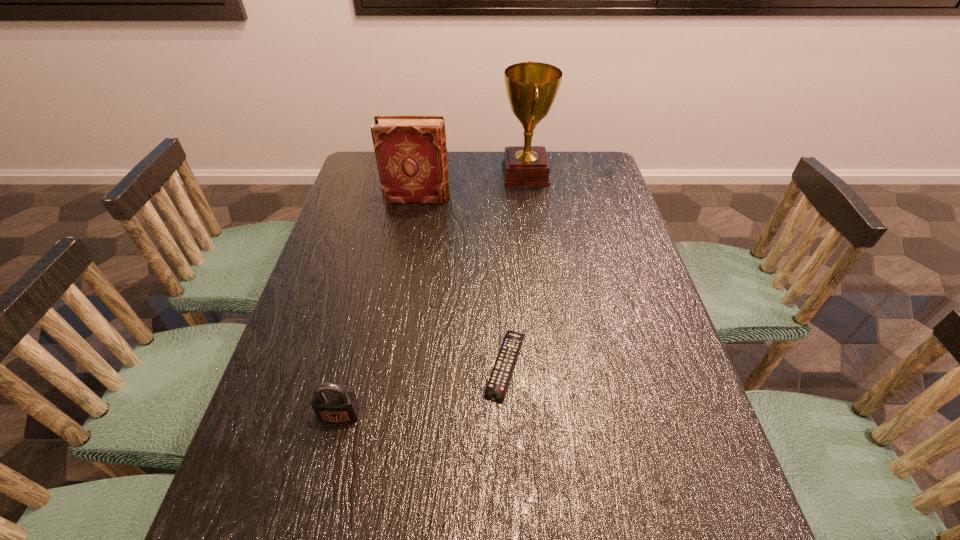
I want to click on vacant space located on the front of the third tallest object near the keyhole, so (315, 517).

The height and width of the screenshot is (540, 960). Identify the location of vacant space situated 0.320m on the back of the remote control. (499, 244).

In order to click on object that is at the far edge in this screenshot , I will do (x=532, y=87).

This screenshot has height=540, width=960. What are the coordinates of `hardback book that is at the left edge` in the screenshot? It's located at (411, 154).

You are a GUI agent. You are given a task and a screenshot of the screen. Output one action in this format:
    pyautogui.click(x=<x>, y=<y>)
    Task: Click on the padlock that is at the left edge
    
    Given the screenshot: What is the action you would take?
    pyautogui.click(x=331, y=403)

In the image, there is a desktop. At what (x,y) coordinates should I click in order to perform the action: click on vacant space at the far edge. Please return your answer as a coordinate pair (x, y). This screenshot has height=540, width=960. Looking at the image, I should click on (484, 175).

Locate an element on the screen. The height and width of the screenshot is (540, 960). vacant area at the left edge of the desktop is located at coordinates (321, 312).

Where is `vacant space at the right edge of the desktop`? Image resolution: width=960 pixels, height=540 pixels. vacant space at the right edge of the desktop is located at coordinates (626, 319).

This screenshot has width=960, height=540. What are the coordinates of `vacant space at the far left corner of the desktop` in the screenshot? It's located at (359, 185).

The image size is (960, 540). What are the coordinates of `blank space at the near left corner of the desktop` in the screenshot? It's located at (309, 538).